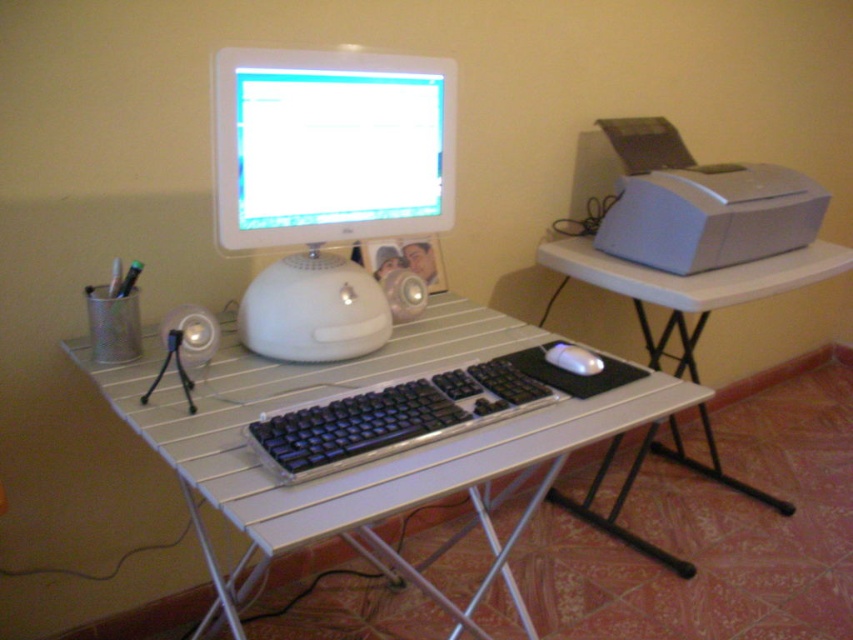
Question: Which object appears farthest from the camera in this image?

Choices:
 (A) metallic silver computer desk at center
 (B) black plastic keyboard at center
 (C) white plastic table at right

Answer: (C)

Question: Is metallic silver computer desk at center in front of black plastic keyboard at center?

Choices:
 (A) yes
 (B) no

Answer: (A)

Question: Which point is farther to the camera?

Choices:
 (A) (260, 168)
 (B) (730, 252)
 (C) (599, 356)
 (D) (229, 516)

Answer: (B)

Question: Does white glossy monitor at center come behind satin silver printer at right?

Choices:
 (A) no
 (B) yes

Answer: (A)

Question: In this image, where is white glossy monitor at center located relative to white plastic table at right?

Choices:
 (A) left
 (B) right

Answer: (A)

Question: Based on their relative distances, which object is farther from the satin silver printer at right?

Choices:
 (A) black plastic keyboard at center
 (B) satin silver mouse at center

Answer: (A)